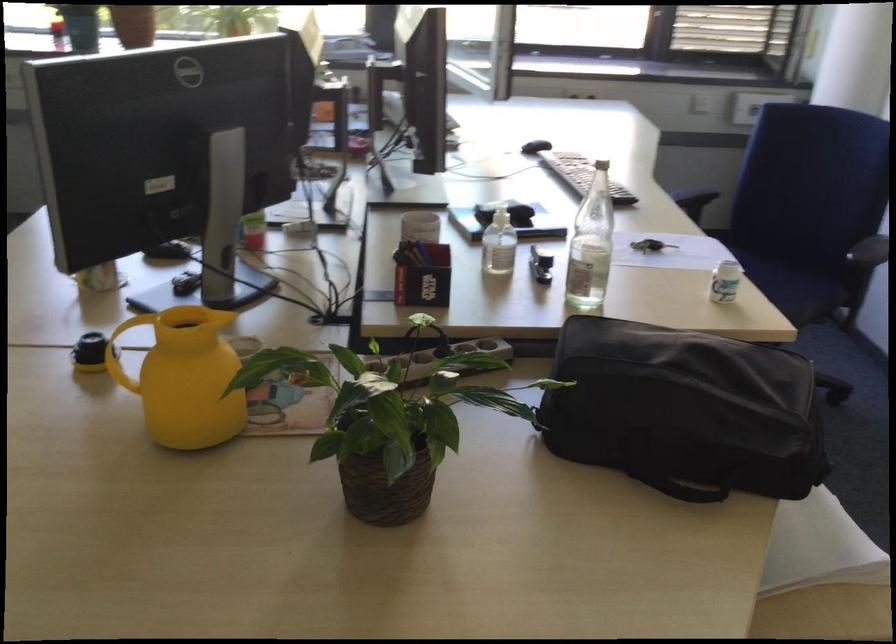
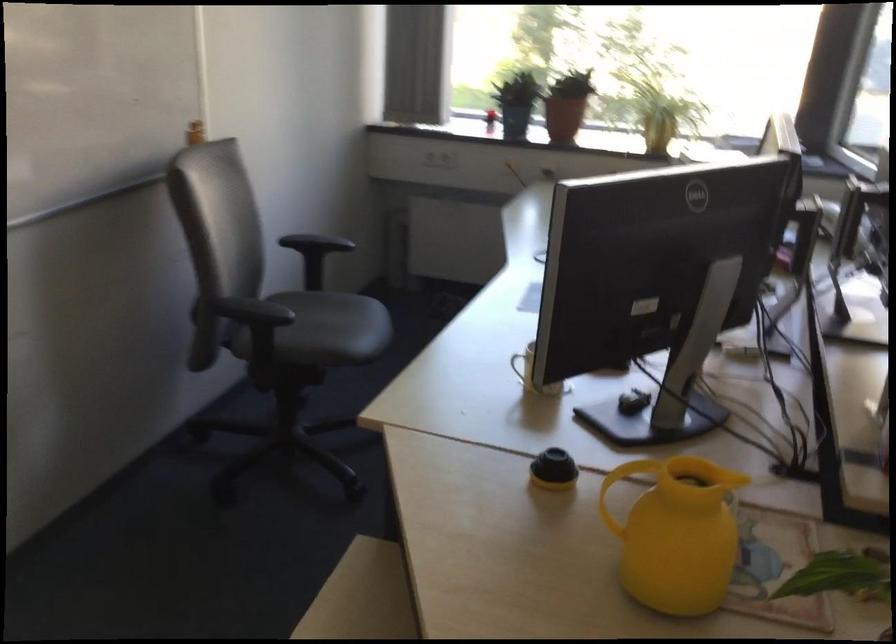
Question: The camera is either moving clockwise (left) or counter-clockwise (right) around the object. The first image is from the beginning of the video and the second image is from the end. Is the camera moving left or right when shooting the video?

Choices:
 (A) Left
 (B) Right

Answer: (B)